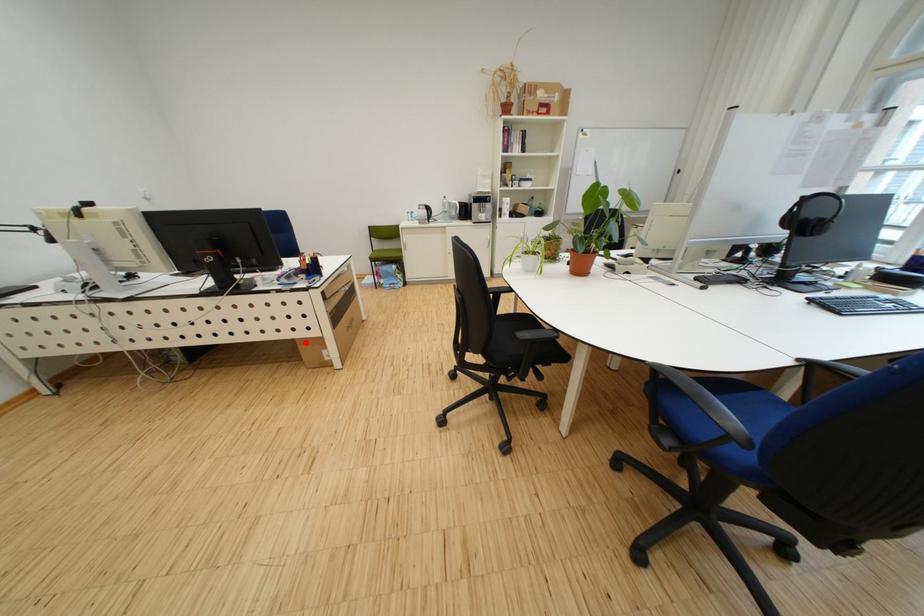
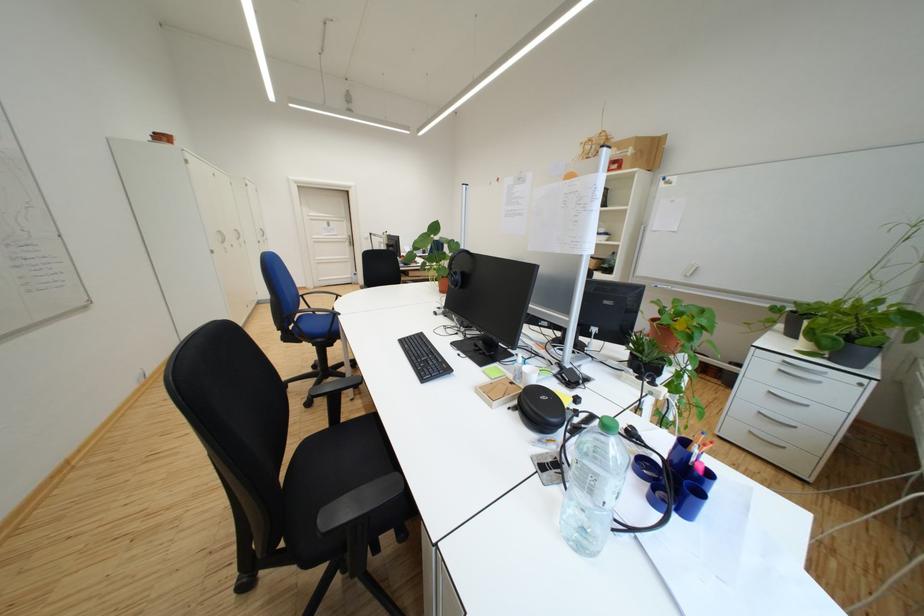
Question: I am providing you with two images of the same scene from different viewpoints. A red point is marked on the first image. At the location where the point appears in image 1, is it still visible in image 2?

Choices:
 (A) Yes
 (B) No

Answer: (B)